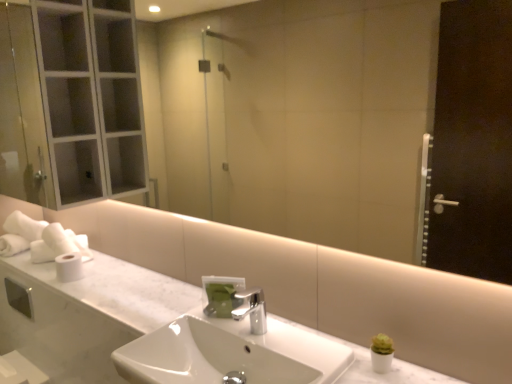
What are the coordinates of `vacant space to the right of polished metallic faucet at center` in the screenshot? It's located at (292, 338).